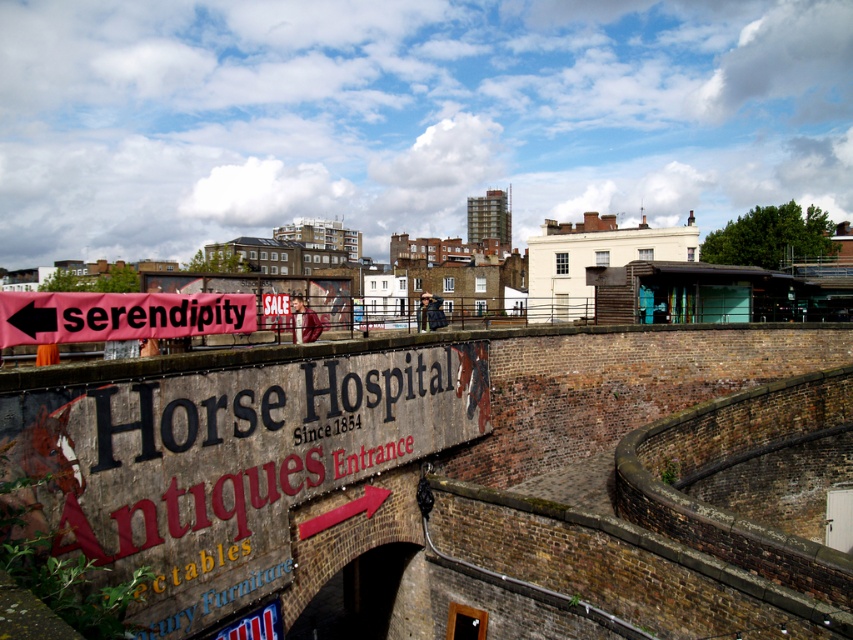
Is point (83, 384) positioned in front of point (33, 336)?

Yes, it is.

Can you confirm if brick wall at center is positioned above pink fabric banner at left?

No.

I want to click on brick wall at center, so click(445, 477).

This screenshot has height=640, width=853. In order to click on brick wall at center in this screenshot , I will do tap(445, 477).